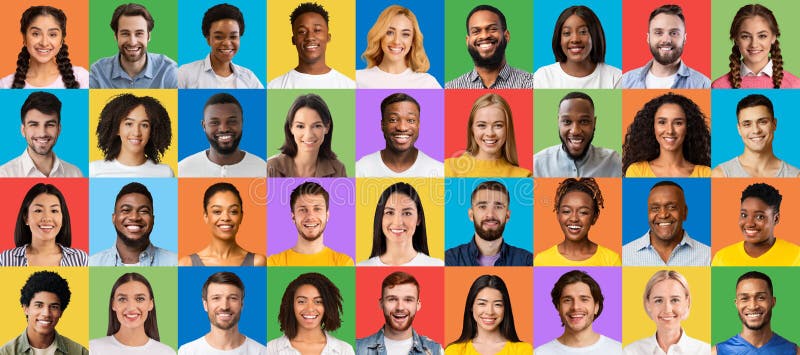
The width and height of the screenshot is (800, 355). I want to click on pictures in 2nd row from top, so (x=42, y=135), (x=133, y=132), (x=220, y=137), (x=304, y=129), (x=400, y=127), (x=490, y=130), (x=576, y=128), (x=670, y=128), (x=758, y=130).